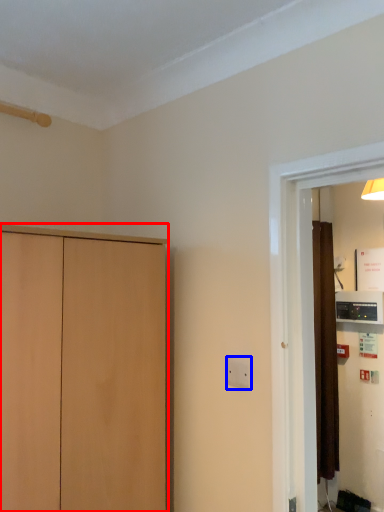
Question: Which object appears farthest to the camera in this image, cupboard (highlighted by a red box) or electric outlet (highlighted by a blue box)?

Choices:
 (A) cupboard
 (B) electric outlet

Answer: (B)